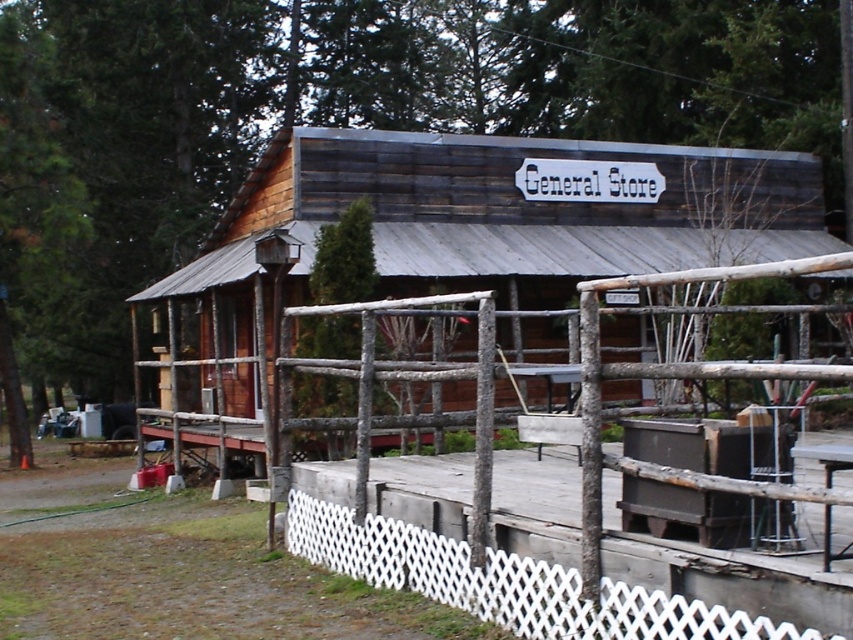
You are a painter standing in front of the General Store and want to paint both the white lattice fence at center and the white lattice fence at lower center. Which fence should you focus on first if you want to paint the larger one?

The white lattice fence at center is bigger than the white lattice fence at lower center, so you should focus on painting the white lattice fence at center first.

You are a painter who wants to paint both fences in the scene. The white lattice fence at center and the white lattice fence at lower center. Which fence requires more paint because it is wider?

The white lattice fence at center requires more paint because its width is larger than the white lattice fence at lower center.

You are standing in front of the General Store and want to hang a banner from the top of the weathered wood cabin at center to the white lattice fence at lower center. Considering their heights, will the banner touch the ground?

The weathered wood cabin at center is taller than the white lattice fence at lower center, so the banner hung from the top of the cabin to the fence will slope downward. Since the fence is shorter, the lowest point of the banner will be near the fence. If the banner is long enough to reach the fence but not excessively so, it might not touch the ground. However, without knowing the exact length of the banner, we can only confirm that the banner will slope from the higher cabin to the lower fence, but cannot